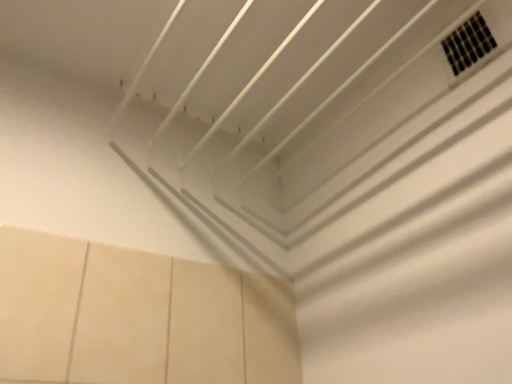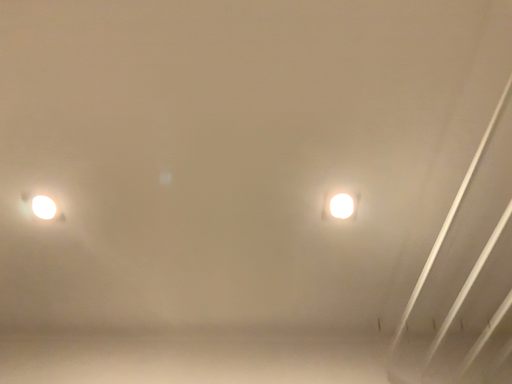
Question: Which way did the camera rotate in the video?

Choices:
 (A) rotated downward
 (B) rotated upward

Answer: (B)